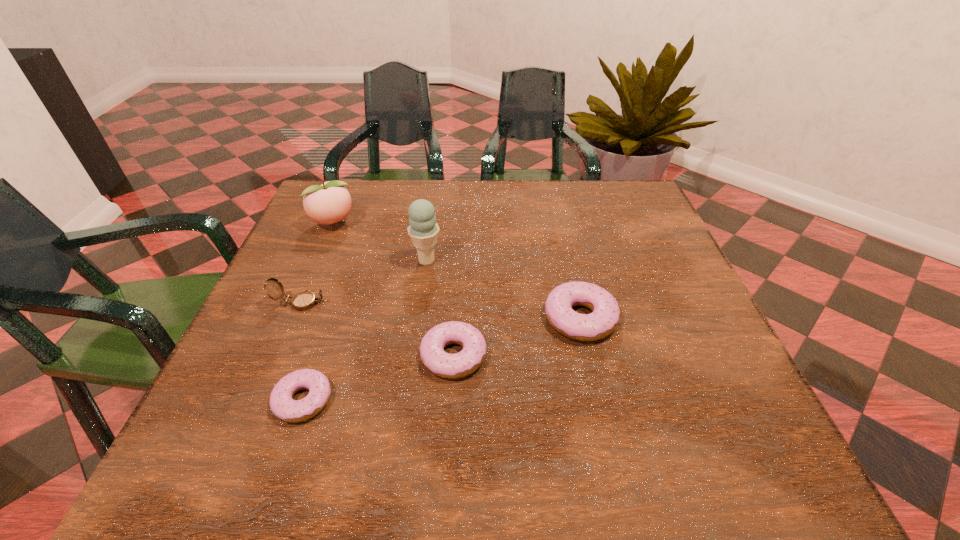
The width and height of the screenshot is (960, 540). Identify the location of the third tallest object. point(305,300).

Locate an element on the screen. The image size is (960, 540). vacant space positioned on the right of the leftmost doughnut is located at coordinates (419, 400).

I want to click on free location located 0.210m on the right of the second shortest object, so click(598, 355).

At what (x,y) coordinates should I click in order to perform the action: click on free location located 0.060m on the back of the rightmost object. Please return your answer as a coordinate pair (x, y). This screenshot has height=540, width=960. Looking at the image, I should click on (570, 274).

You are a GUI agent. You are given a task and a screenshot of the screen. Output one action in this format:
    pyautogui.click(x=<x>, y=<y>)
    Task: Click on the free spot located on the right of the peach
    
    Given the screenshot: What is the action you would take?
    pyautogui.click(x=451, y=224)

Where is `free space located 0.090m on the right of the ice cream`? This screenshot has width=960, height=540. free space located 0.090m on the right of the ice cream is located at coordinates (480, 261).

In order to click on vacant space located on the face of the compass in this screenshot , I will do `click(374, 303)`.

You are a GUI agent. You are given a task and a screenshot of the screen. Output one action in this format:
    pyautogui.click(x=<x>, y=<y>)
    Task: Click on the object located at the far edge
    This screenshot has height=540, width=960.
    Given the screenshot: What is the action you would take?
    pyautogui.click(x=328, y=203)

The width and height of the screenshot is (960, 540). In order to click on doughnut that is at the left edge in this screenshot , I will do `click(282, 405)`.

Locate an element on the screen. This screenshot has width=960, height=540. peach situated at the left edge is located at coordinates (328, 203).